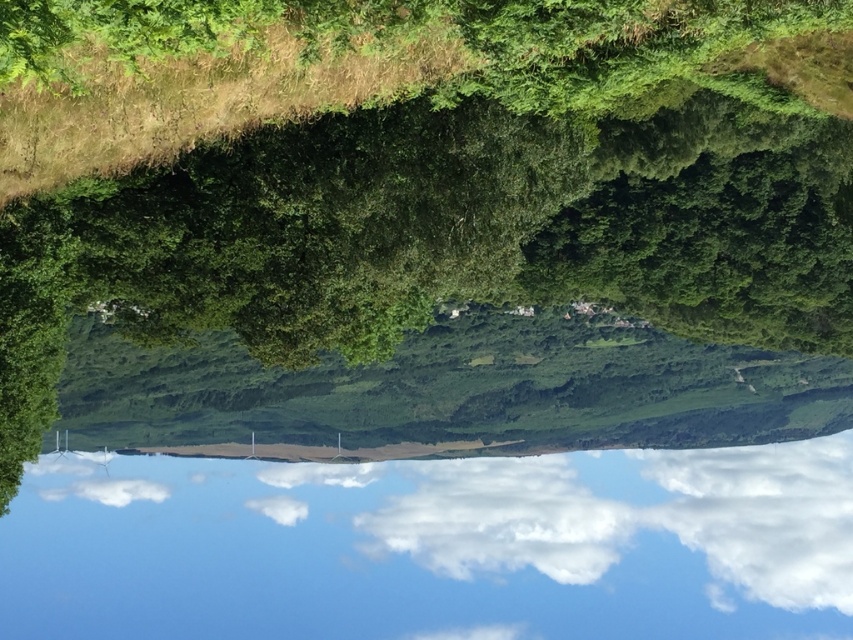
Question: Considering the relative positions of green leafy tree at upper center and white fluffy cloud at upper center in the image provided, where is green leafy tree at upper center located with respect to white fluffy cloud at upper center?

Choices:
 (A) right
 (B) left

Answer: (B)

Question: Is green leafy tree at upper center further to the viewer compared to white fluffy cloud at center?

Choices:
 (A) no
 (B) yes

Answer: (A)

Question: Which point is closer to the camera?

Choices:
 (A) green leafy tree at upper center
 (B) white fluffy cloud at center

Answer: (A)

Question: Based on their relative distances, which object is nearer to the white fluffy cloud at upper center?

Choices:
 (A) transparent glass water at center
 (B) white fluffy cloud at center

Answer: (A)

Question: Can you confirm if white fluffy cloud at upper center is thinner than white fluffy cloud at center?

Choices:
 (A) no
 (B) yes

Answer: (B)

Question: Which point appears closest to the camera in this image?

Choices:
 (A) (601, 538)
 (B) (761, 593)
 (C) (738, 145)
 (D) (576, 593)

Answer: (C)